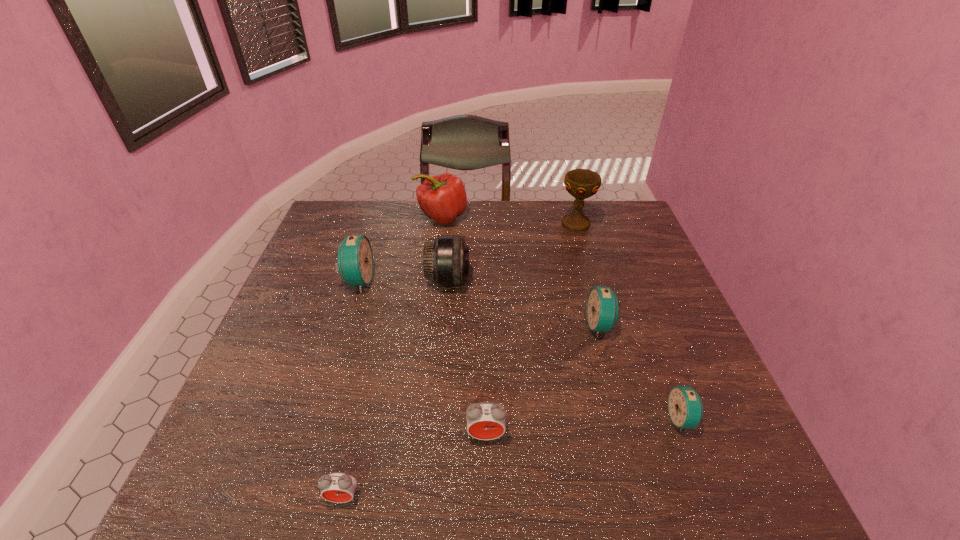
Locate an element on the screen. The width and height of the screenshot is (960, 540). free space located on the face of the fifth object from left to right is located at coordinates (487, 487).

Where is `vacant space situated 0.400m on the front-facing side of the rightmost object`? vacant space situated 0.400m on the front-facing side of the rightmost object is located at coordinates (475, 419).

The height and width of the screenshot is (540, 960). In order to click on free space located on the front-facing side of the rightmost object in this screenshot , I will do `click(548, 419)`.

Locate an element on the screen. Image resolution: width=960 pixels, height=540 pixels. vacant space positioned on the front-facing side of the rightmost object is located at coordinates [558, 419].

The height and width of the screenshot is (540, 960). In order to click on chalice at the far edge in this screenshot , I will do `click(580, 183)`.

Find the location of a particular element. Image resolution: width=960 pixels, height=540 pixels. bell pepper located at the far edge is located at coordinates (442, 198).

Find the location of `object that is at the near edge`. object that is at the near edge is located at coordinates (338, 487).

The width and height of the screenshot is (960, 540). I want to click on object positioned at the left edge, so click(x=355, y=264).

Identify the location of chalice that is positioned at the right edge. The height and width of the screenshot is (540, 960). (580, 183).

Identify the location of alarm clock situated at the right edge. (685, 407).